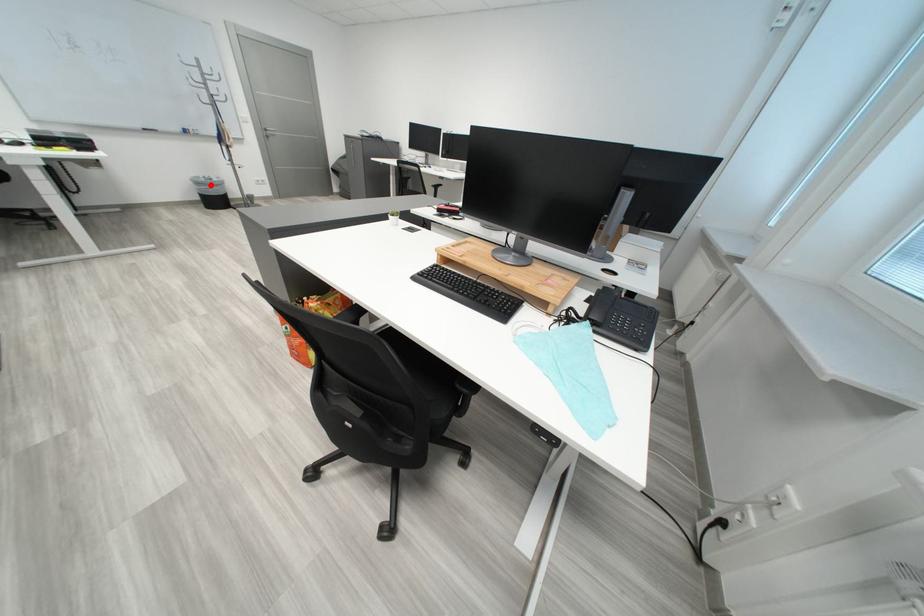
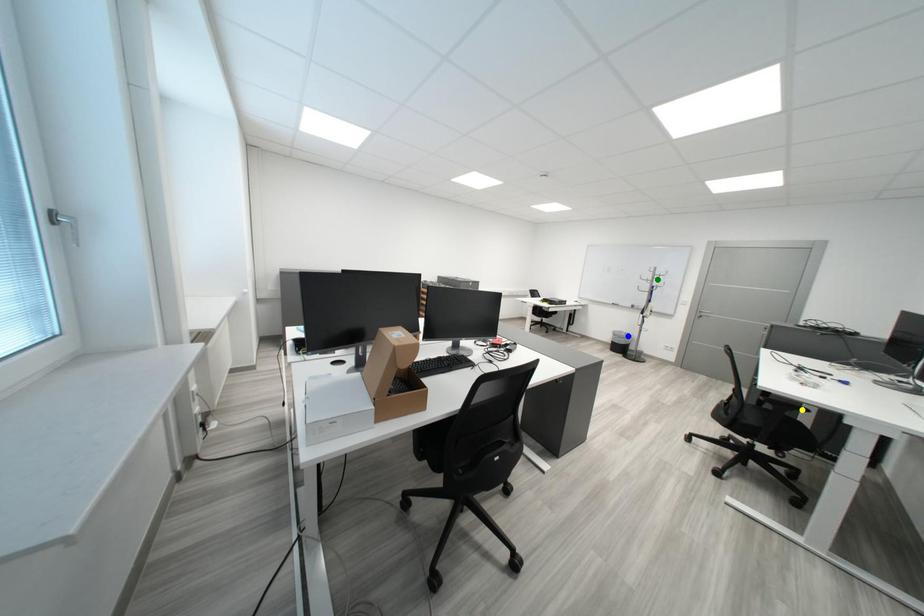
Question: I am providing you with two images of the same scene from different viewpoints. A red point is marked on the first image. You are given multiple points on the second image. In image 2, which mark is for the same physical point as the one in image 1?

Choices:
 (A) yellow point
 (B) green point
 (C) blue point

Answer: (C)